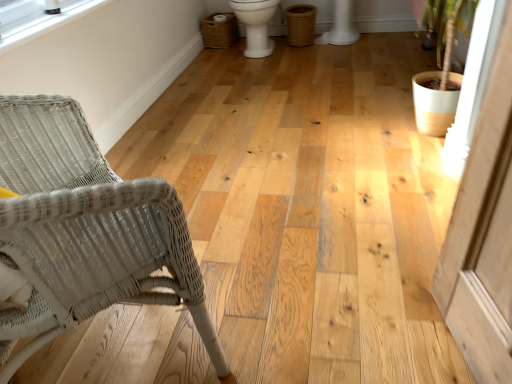
Locate an element on the screen. The width and height of the screenshot is (512, 384). free point below white wicker chair at left (from a real-world perspective) is located at coordinates (136, 344).